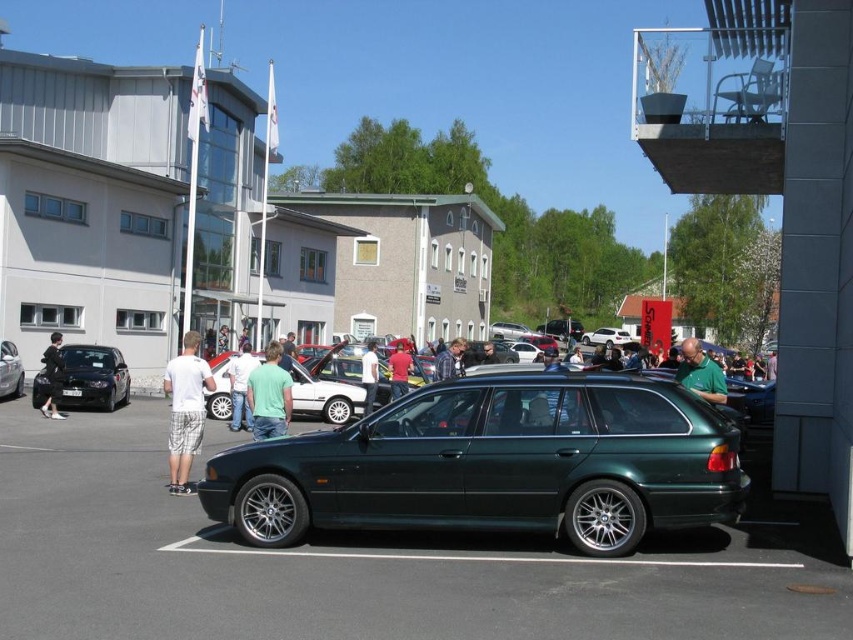
Consider the image. You are a photographer at the car show. You want to take a photo of the shiny black sedan at left and the green fabric shirt at center so that both are visible in the frame. Considering their heights, which object should you position closer to the camera to ensure both are fully visible?

The shiny black sedan at left has a lesser height compared to green fabric shirt at center. To ensure both are fully visible in the photo, position the shiny black sedan at left closer to the camera so its smaller height is captured without cropping, while the taller green fabric shirt at center can be placed slightly farther back.

You are a photographer at the car show and want to capture both the green metallic sedan at center and the matte black car at center in a single shot. Since you want both cars to be clearly visible, which car should you focus on first to ensure sharpness?

The green metallic sedan at center is closer to the viewer than the matte black car at center, so focusing on the green metallic sedan at center first will ensure both cars are in focus as the matte black car at center is further away.